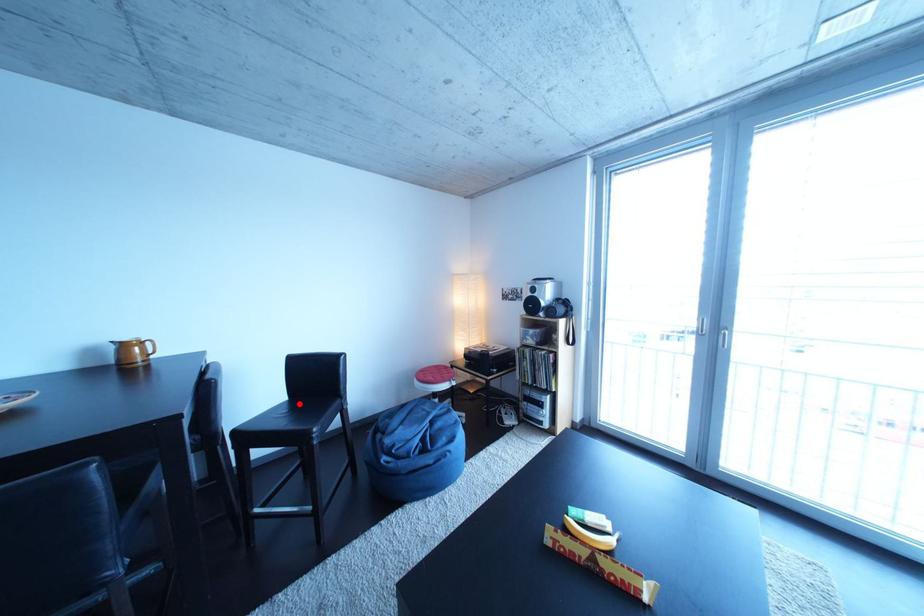
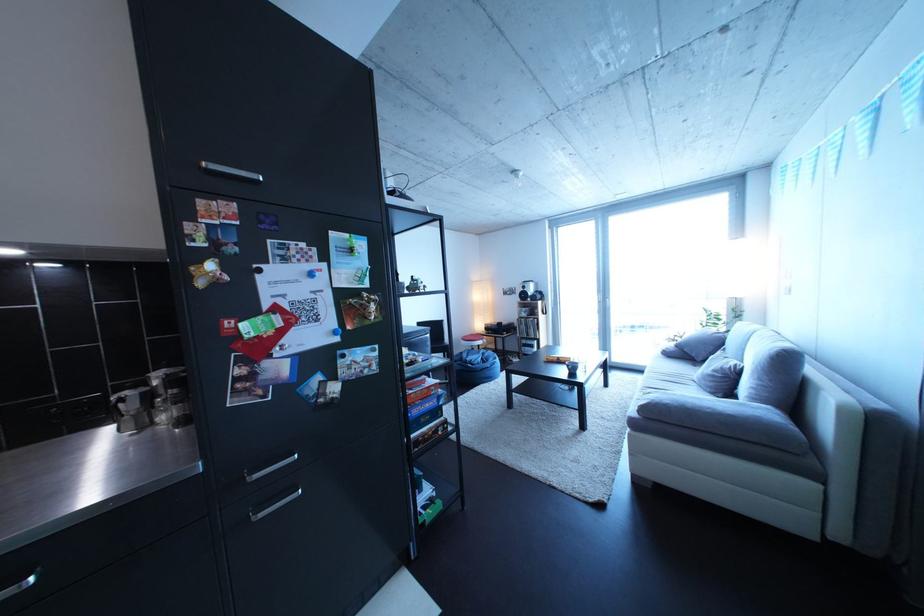
Question: I am providing you with two images of the same scene from different viewpoints. A red point is marked on the first image. Can you still see the location of the red point in image 2?

Choices:
 (A) Yes
 (B) No

Answer: (B)